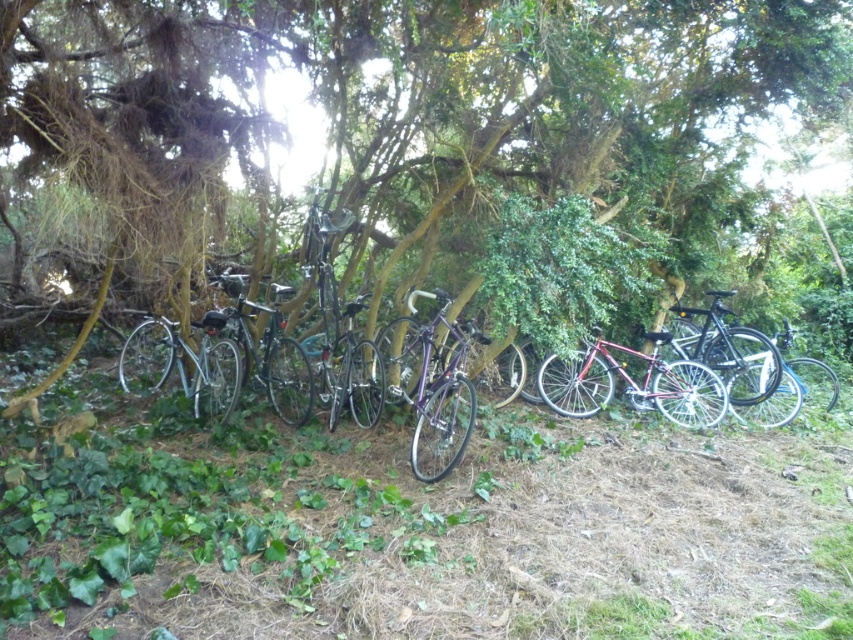
Is point (717, 339) in front of point (773, 337)?

Yes.

Image resolution: width=853 pixels, height=640 pixels. In order to click on shiny black bicycle at center in this screenshot , I will do `click(691, 380)`.

Is point (381, 364) farther from camera compared to point (750, 406)?

That is False.

The height and width of the screenshot is (640, 853). What are the coordinates of `shiny black bicycle at center` in the screenshot? It's located at (691, 380).

Between shiny black bicycle at center and shiny black bicycle at right, which one is positioned higher?

shiny black bicycle at right is above.

Looking at this image, can you confirm if shiny black bicycle at center is taller than shiny black bicycle at right?

Indeed, shiny black bicycle at center has a greater height compared to shiny black bicycle at right.

Measure the distance between shiny black bicycle at center and camera.

A distance of 3.70 meters exists between shiny black bicycle at center and camera.

Image resolution: width=853 pixels, height=640 pixels. Identify the location of shiny black bicycle at center. (691, 380).

Is shiny black bicycle at center below shiny black mountain bike at center?

Indeed, shiny black bicycle at center is positioned under shiny black mountain bike at center.

Between shiny black bicycle at center and shiny black mountain bike at center, which one has less height?

Standing shorter between the two is shiny black bicycle at center.

Looking at this image, measure the distance between point (437, 378) and camera.

Point (437, 378) and camera are 3.14 meters apart.

Locate an element on the screen. The height and width of the screenshot is (640, 853). shiny black bicycle at center is located at coordinates (691, 380).